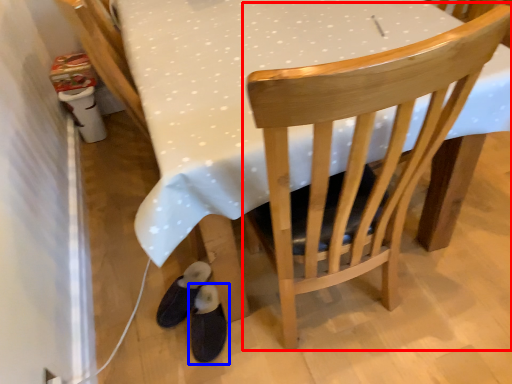
Question: Which object appears farthest to the camera in this image, chair (highlighted by a red box) or footwear (highlighted by a blue box)?

Choices:
 (A) chair
 (B) footwear

Answer: (B)